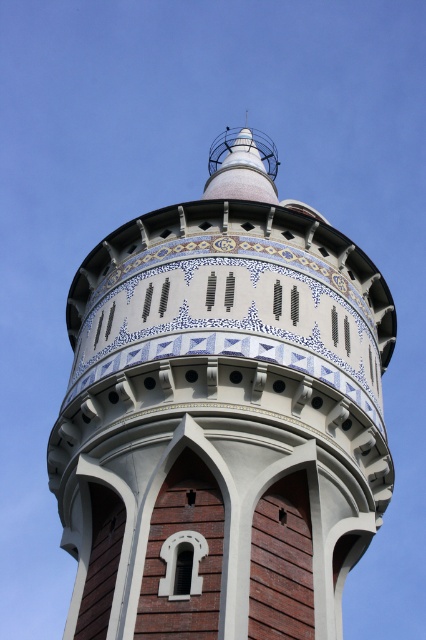
Does point (299, 580) come closer to viewer compared to point (224, 172)?

Yes, point (299, 580) is in front of point (224, 172).

Between white ceramic tower at center and white glossy spire at upper center, which one has more height?

Standing taller between the two is white glossy spire at upper center.

You are a GUI agent. You are given a task and a screenshot of the screen. Output one action in this format:
    pyautogui.click(x=<x>, y=<y>)
    Task: Click on the white ceramic tower at center
    The height and width of the screenshot is (640, 426).
    Given the screenshot: What is the action you would take?
    pyautogui.click(x=221, y=424)

Where is `white ceramic tower at center`? Image resolution: width=426 pixels, height=640 pixels. white ceramic tower at center is located at coordinates (221, 424).